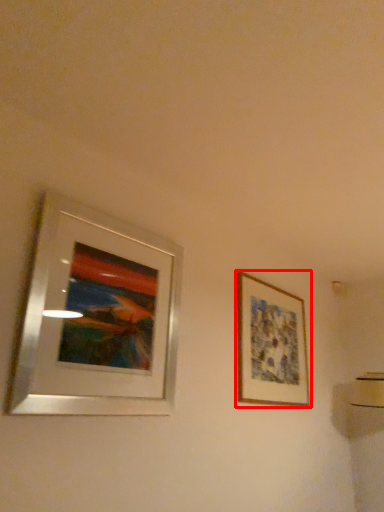
Question: In this image, where is picture frame (annotated by the red box) located relative to picture frame?

Choices:
 (A) left
 (B) right

Answer: (B)